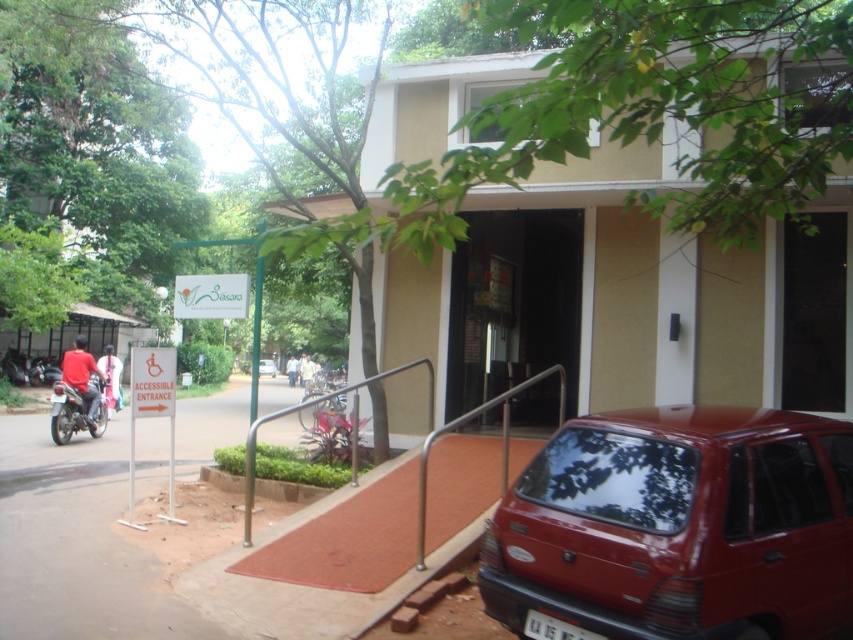
Consider the image. Is silver metallic handrail at center below shiny black motorcycle at left?

Incorrect, silver metallic handrail at center is not positioned below shiny black motorcycle at left.

Is point (461, 422) positioned behind point (70, 396)?

No.

You are a GUI agent. You are given a task and a screenshot of the screen. Output one action in this format:
    pyautogui.click(x=<x>, y=<y>)
    Task: Click on the silver metallic handrail at center
    This screenshot has width=853, height=640.
    Given the screenshot: What is the action you would take?
    pyautogui.click(x=502, y=442)

Does shiny black motorcycle at left have a larger size compared to matte red car at center?

Incorrect, shiny black motorcycle at left is not larger than matte red car at center.

Is point (90, 403) more distant than point (263, 364)?

No, it is not.

Image resolution: width=853 pixels, height=640 pixels. Find the location of `shiny black motorcycle at left`. shiny black motorcycle at left is located at coordinates (73, 413).

Is matte red car at lower right behind matte red car at center?

No, matte red car at lower right is closer to the viewer.

Does matte red car at lower right have a greater height compared to matte red car at center?

No.

From the picture: Who is more distant from viewer, (523, 560) or (271, 376)?

The point (271, 376) is behind.

Find the location of `matte red car at lower right`. matte red car at lower right is located at coordinates (679, 525).